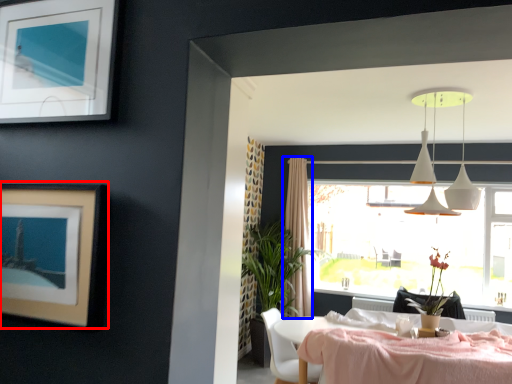
Question: Which object appears closest to the camera in this image, picture frame (highlighted by a red box) or curtain (highlighted by a blue box)?

Choices:
 (A) picture frame
 (B) curtain

Answer: (A)